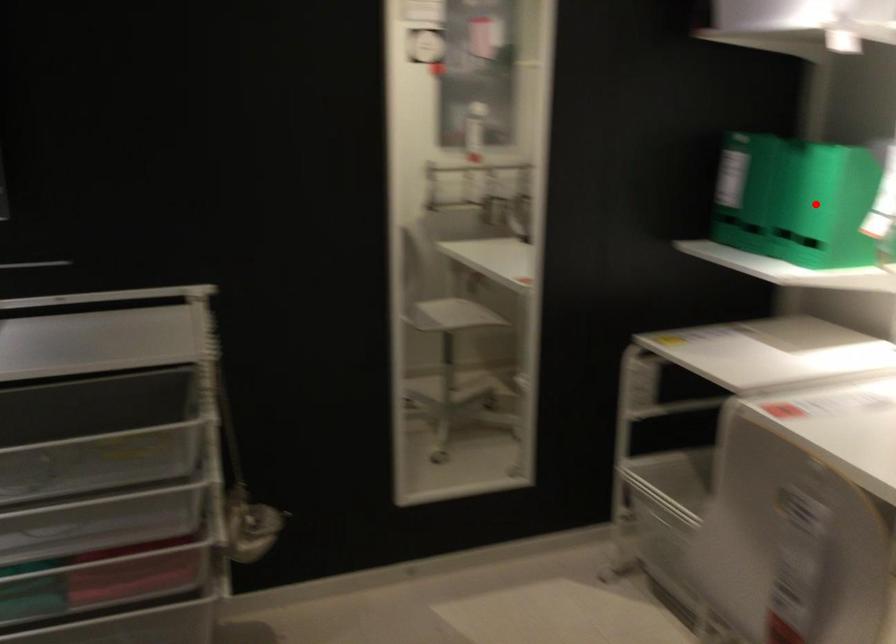
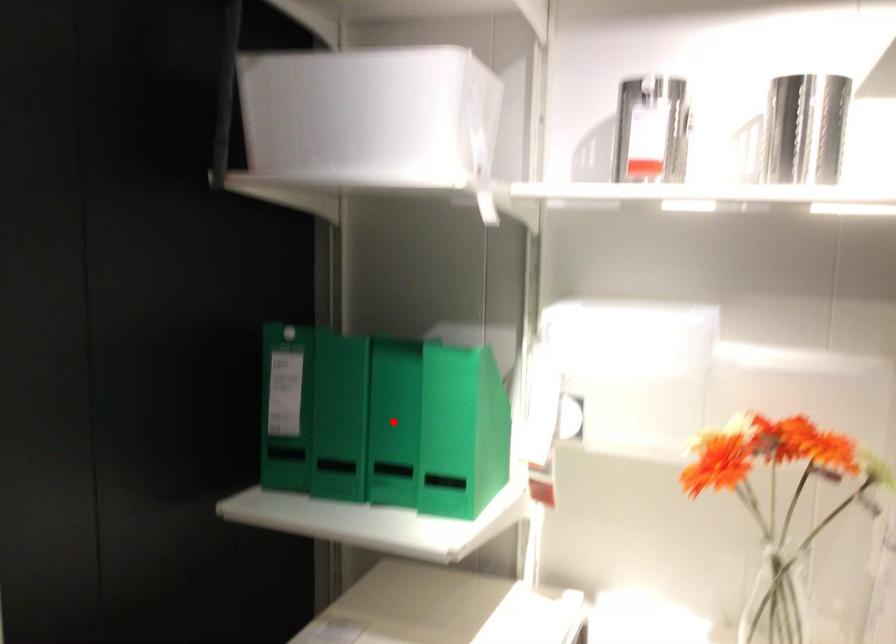
I am providing you with two images of the same scene from different viewpoints. A red point is marked on the first image and another point is marked on the second image. Are the points marked in image1 and image2 representing the same 3D position?

No